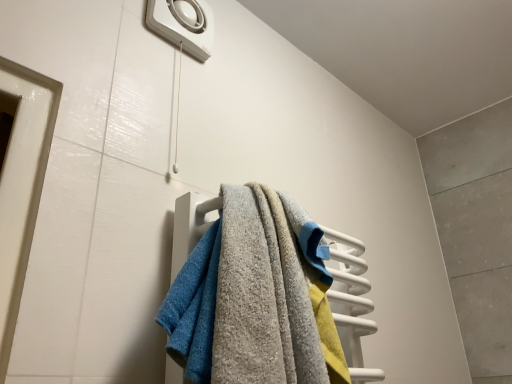
This screenshot has width=512, height=384. What do you see at coordinates (194, 308) in the screenshot? I see `textured gray towel at center` at bounding box center [194, 308].

I want to click on textured gray towel at center, so click(194, 308).

Image resolution: width=512 pixels, height=384 pixels. I want to click on textured gray towel at center, so click(x=194, y=308).